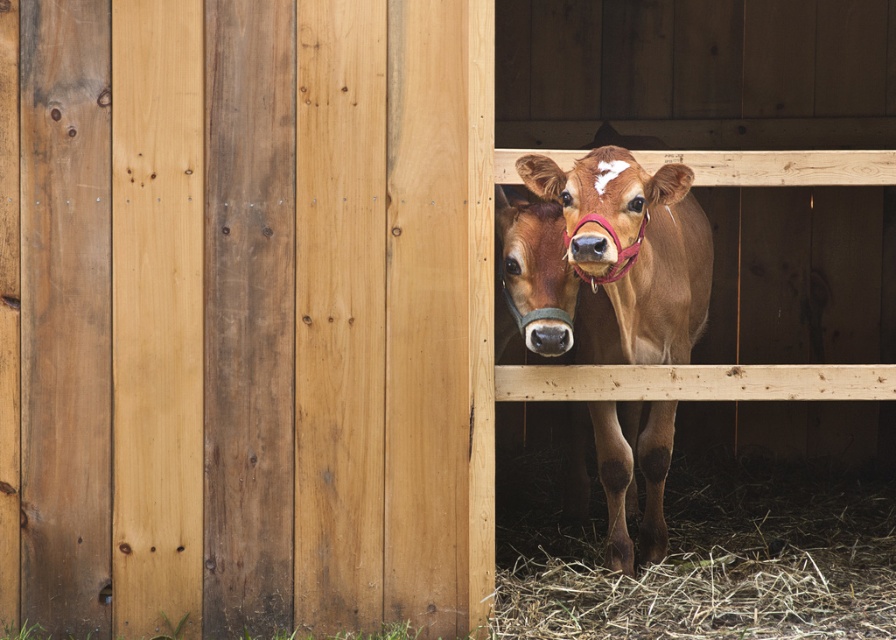
Question: Which point is farther to the camera?

Choices:
 (A) brown matte cow at center
 (B) natural wood barn door at center
 (C) brown matte cow nose at center

Answer: (B)

Question: Is natural wood barn door at center thinner than brown matte cow at center?

Choices:
 (A) yes
 (B) no

Answer: (B)

Question: Does natural wood barn door at center have a lesser width compared to brown matte cow nose at center?

Choices:
 (A) no
 (B) yes

Answer: (A)

Question: Considering the real-world distances, which object is farthest from the natural wood barn door at center?

Choices:
 (A) brown matte cow at center
 (B) brown matte cow nose at center

Answer: (B)

Question: Which point is farther to the camera?

Choices:
 (A) brown matte cow nose at center
 (B) brown matte cow at center
 (C) natural wood barn door at center

Answer: (C)

Question: Is natural wood barn door at center thinner than brown matte cow at center?

Choices:
 (A) no
 (B) yes

Answer: (A)